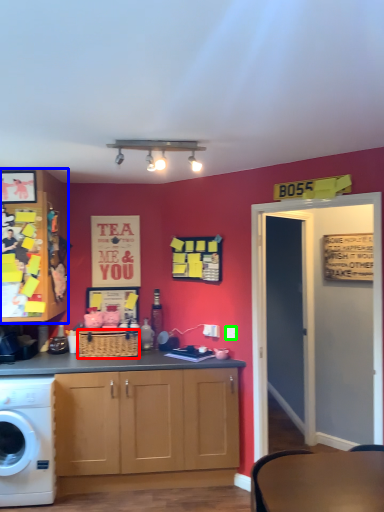
Question: Which is nearer to the picnic basket (highlighted by a red box)? cabinetry (highlighted by a blue box) or power outlet (highlighted by a green box).

Choices:
 (A) cabinetry
 (B) power outlet

Answer: (A)